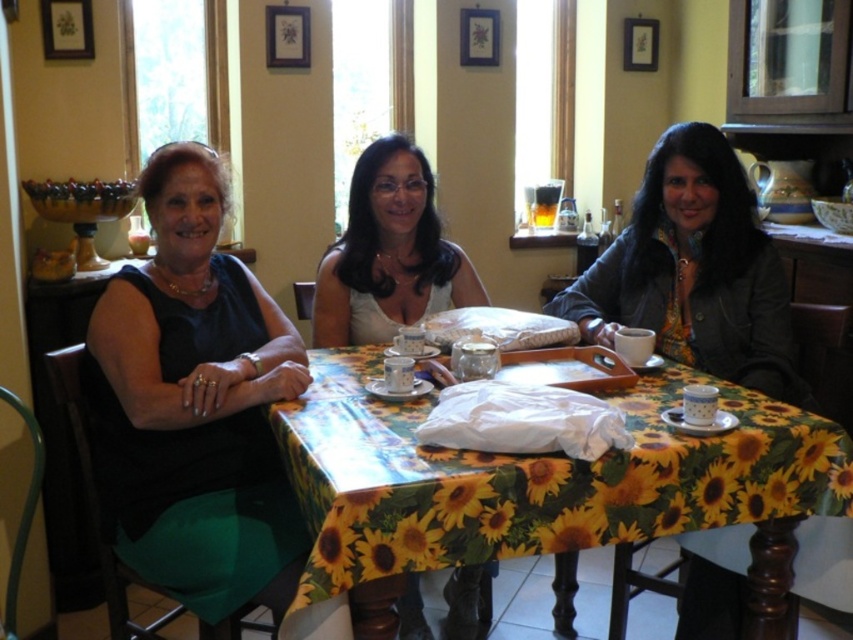
Question: Is white matte dress at center wider than matte white blouse at center?

Choices:
 (A) yes
 (B) no

Answer: (B)

Question: Can you confirm if yellow floral tablecloth at center is positioned to the right of black satin dress at left?

Choices:
 (A) no
 (B) yes

Answer: (B)

Question: Is black satin dress at left to the right of leather jacket at right from the viewer's perspective?

Choices:
 (A) no
 (B) yes

Answer: (A)

Question: Which point is farther from the camera taking this photo?

Choices:
 (A) (177, 304)
 (B) (422, 172)
 (C) (672, 260)
 (D) (357, 522)

Answer: (B)

Question: Which point appears farthest from the camera in this image?

Choices:
 (A) (350, 204)
 (B) (749, 381)

Answer: (A)

Question: Which point is farther to the camera?

Choices:
 (A) (599, 317)
 (B) (483, 292)
 (C) (529, 504)
 (D) (364, 284)

Answer: (B)